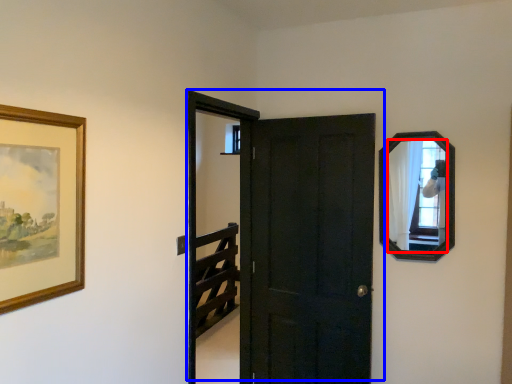
Question: Which object appears closest to the camera in this image, mirror (highlighted by a red box) or door (highlighted by a blue box)?

Choices:
 (A) mirror
 (B) door

Answer: (A)